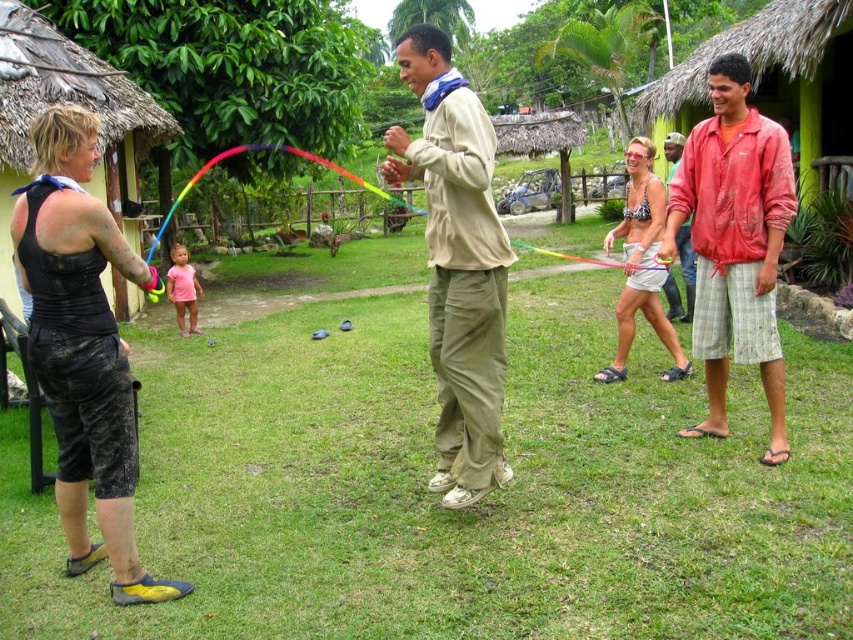
You are standing at the center of the image and see the beige fabric pants at center. Which direction should you move to reach the point marked as point [457,262]?

The beige fabric pants at center are already located at point [457,262], so you don not need to move in any direction to reach that point.

You are a photographer trying to capture a clear shot of both the beige fabric pants at center and the rainbow plastic kite at center. Which object should you focus on first if you want to ensure the thinner one is in sharp focus?

The beige fabric pants at center is thinner than the rainbow plastic kite at center, so you should focus on the beige fabric pants at center first to ensure it is in sharp focus.

You are a photographer standing in the center of the scene. You want to take a photo that includes both the black matte shorts at left and the red fabric shirt at right. Which object should you focus on first to ensure both are in frame?

You should focus on the black matte shorts at left first because it is closer to the viewer, allowing you to adjust the camera angle to include both it and the red fabric shirt at right in the frame.